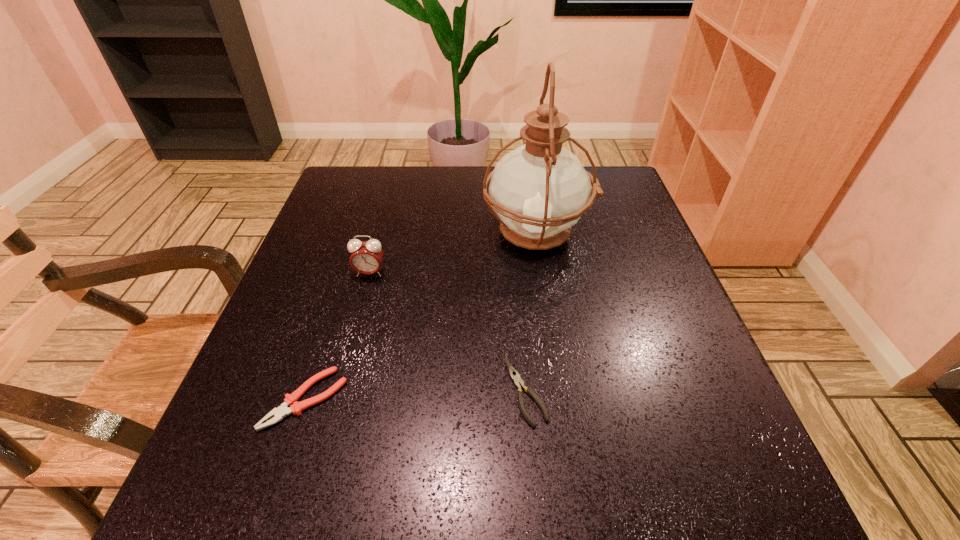
The image size is (960, 540). I want to click on pliers that is at the left edge, so click(x=280, y=412).

This screenshot has height=540, width=960. Identify the location of object positioned at the right edge. (539, 190).

You are a GUI agent. You are given a task and a screenshot of the screen. Output one action in this format:
    pyautogui.click(x=<x>, y=<y>)
    Task: Click on the object that is positioned at the far right corner
    The width and height of the screenshot is (960, 540).
    Given the screenshot: What is the action you would take?
    [x=539, y=190]

At what (x,y) coordinates should I click in order to perform the action: click on vacant area at the far edge. Please return your answer as a coordinate pair (x, y). This screenshot has width=960, height=540. Looking at the image, I should click on (444, 166).

This screenshot has height=540, width=960. Identify the location of vacant region at the near edge. (642, 503).

Where is `free space at the left edge of the desktop`? Image resolution: width=960 pixels, height=540 pixels. free space at the left edge of the desktop is located at coordinates (363, 216).

The height and width of the screenshot is (540, 960). Identify the location of free space at the right edge. (584, 236).

What are the coordinates of `vacant area at the far left corner` in the screenshot? It's located at (377, 173).

The height and width of the screenshot is (540, 960). Identify the location of vacant space at the near left corner of the desktop. (305, 494).

Identify the location of vacant area between the tallest object and the third shortest object. The width and height of the screenshot is (960, 540). (453, 253).